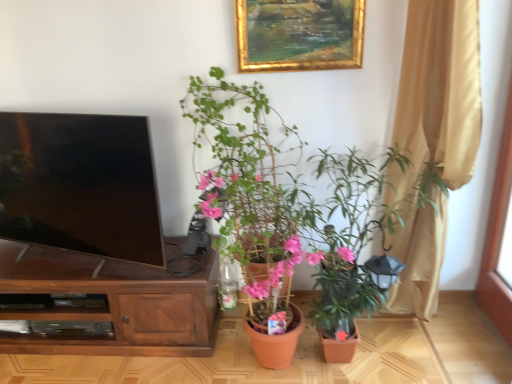
Question: Is matte terracotta pot at center, marked as the 2th houseplant in a right-to-left arrangement, bigger than beige fabric curtain at right?

Choices:
 (A) no
 (B) yes

Answer: (B)

Question: From the image's perspective, is matte terracotta pot at center, acting as the first houseplant starting from the left, over beige fabric curtain at right?

Choices:
 (A) no
 (B) yes

Answer: (A)

Question: Considering the relative positions of matte terracotta pot at center, marked as the 2th houseplant in a right-to-left arrangement, and beige fabric curtain at right in the image provided, is matte terracotta pot at center, marked as the 2th houseplant in a right-to-left arrangement, behind beige fabric curtain at right?

Choices:
 (A) no
 (B) yes

Answer: (A)

Question: Is matte terracotta pot at center, marked as the 2th houseplant in a right-to-left arrangement, thinner than beige fabric curtain at right?

Choices:
 (A) yes
 (B) no

Answer: (B)

Question: Could you tell me if matte terracotta pot at center, marked as the 2th houseplant in a right-to-left arrangement, is turned towards beige fabric curtain at right?

Choices:
 (A) no
 (B) yes

Answer: (A)

Question: From the image's perspective, is matte terracotta pot at center, acting as the first houseplant starting from the left, positioned above or below gold/gilded picture frame at upper center?

Choices:
 (A) above
 (B) below

Answer: (B)

Question: Is point (261, 306) closer or farther from the camera than point (308, 3)?

Choices:
 (A) farther
 (B) closer

Answer: (A)

Question: Relative to gold/gilded picture frame at upper center, is matte terracotta pot at center, marked as the 2th houseplant in a right-to-left arrangement, in front or behind?

Choices:
 (A) front
 (B) behind

Answer: (A)

Question: Is matte terracotta pot at center, marked as the 2th houseplant in a right-to-left arrangement, situated inside gold/gilded picture frame at upper center or outside?

Choices:
 (A) outside
 (B) inside

Answer: (A)

Question: In terms of width, does beige fabric curtain at right look wider or thinner when compared to brown wood cabinet at left?

Choices:
 (A) wide
 (B) thin

Answer: (B)

Question: Is beige fabric curtain at right bigger or smaller than brown wood cabinet at left?

Choices:
 (A) small
 (B) big

Answer: (A)

Question: Would you say beige fabric curtain at right is inside or outside brown wood cabinet at left?

Choices:
 (A) inside
 (B) outside

Answer: (B)

Question: From the image's perspective, is beige fabric curtain at right above or below brown wood cabinet at left?

Choices:
 (A) below
 (B) above

Answer: (B)

Question: Is beige fabric curtain at right inside or outside of matte terracotta pot at center, marked as the 2th houseplant in a right-to-left arrangement?

Choices:
 (A) inside
 (B) outside

Answer: (B)

Question: Does point (420, 34) appear closer or farther from the camera than point (249, 150)?

Choices:
 (A) closer
 (B) farther

Answer: (A)